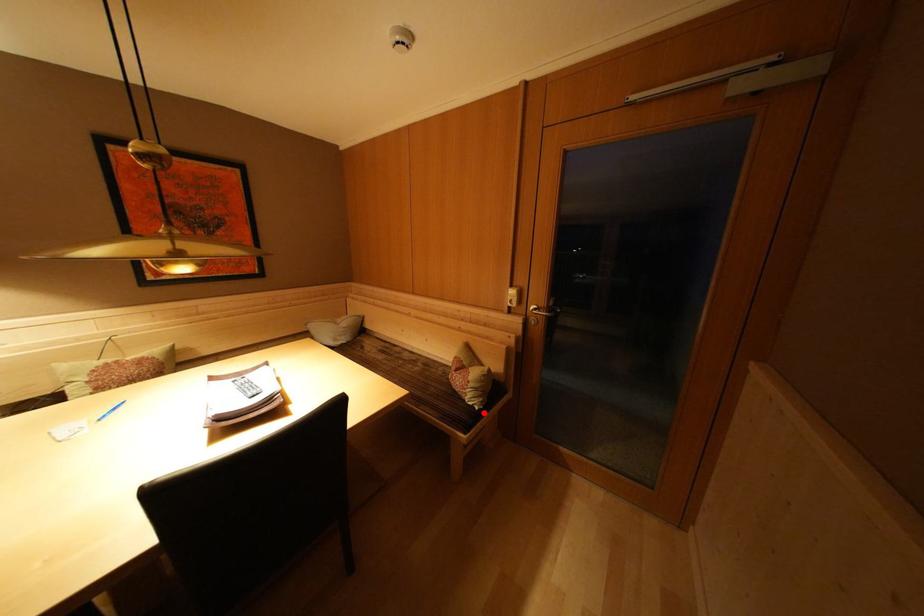
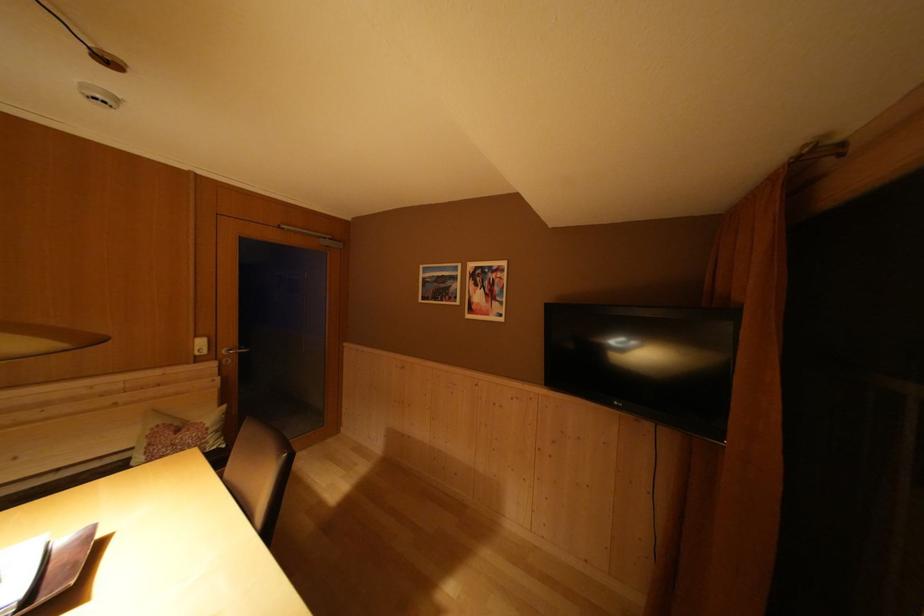
Find the pixel in the second image that matches the highlighted location in the first image.

(231, 451)